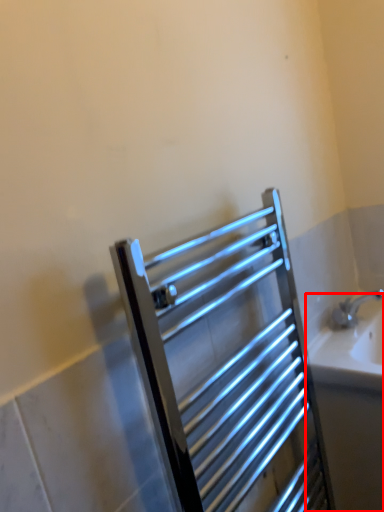
Question: From the image's perspective, where is bath (annotated by the red box) located relative to screen door?

Choices:
 (A) above
 (B) below

Answer: (B)